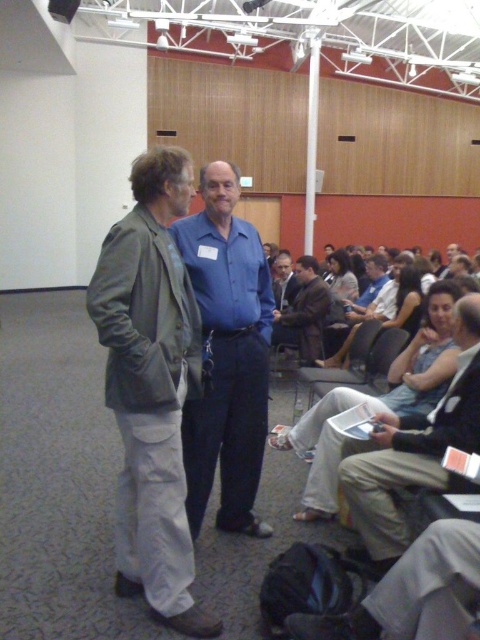
You are standing in the conference room and want to move from point A to point B. Point A is at coordinates point (251, 243) and point B is at coordinates point (348, 262). Which point should you start at if you want to move towards the man on the right?

You should start at point (251, 243) because it is in front of point (348, 262), meaning it is closer to the man on the right.

You are standing in the conference room and want to find the matte black dress at center. According to the coordinates provided, where should you look to locate it?

The matte black dress at center is located at coordinates point (408, 301).

You are organizing a photo shoot and need to arrange two men wearing the blue smooth shirt at center and the light blue shirt at center. Based on their clothing sizes, which man should stand in front to ensure both are visible?

The blue smooth shirt at center is bigger than the light blue shirt at center, so the man wearing the light blue shirt at center should stand in front to ensure both are visible.